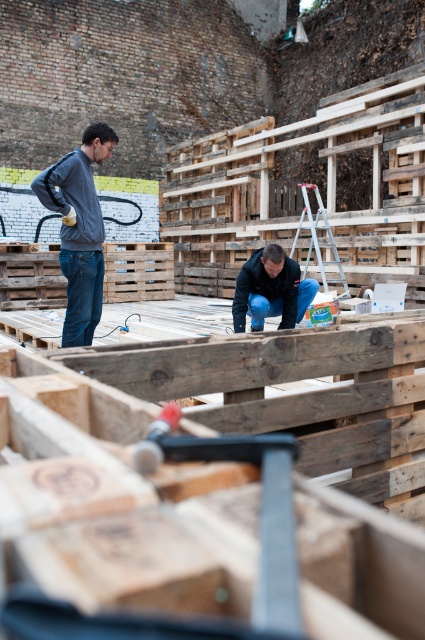
Can you confirm if black rubber hammer at center is smaller than dark blue fabric at center?

Yes, black rubber hammer at center is smaller than dark blue fabric at center.

Where is `black rubber hammer at center`? Image resolution: width=425 pixels, height=640 pixels. black rubber hammer at center is located at coordinates (260, 509).

Does point (79, 189) lie behind point (257, 257)?

No, (79, 189) is closer to viewer.

Is matte gray hoodie at left bigger than dark blue fabric at center?

Yes.

Measure the distance between point (93, 305) and camera.

Point (93, 305) is 4.49 meters from camera.

The image size is (425, 640). In order to click on matte gray hoodie at left in this screenshot , I will do `click(79, 228)`.

Is point (144, 451) farther from camera compared to point (76, 291)?

No, (144, 451) is closer to viewer.

Is black rubber hammer at center to the left of matte gray hoodie at left from the viewer's perspective?

In fact, black rubber hammer at center is to the right of matte gray hoodie at left.

Consider the image. Who is more forward, (288,579) or (73,184)?

Point (288,579) is more forward.

Find the location of `black rubber hammer at center`. black rubber hammer at center is located at coordinates (260, 509).